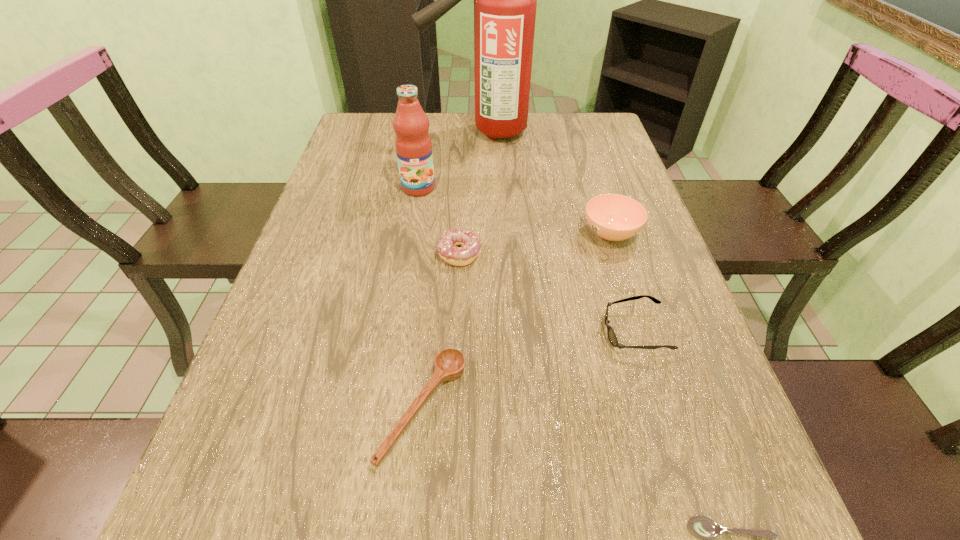
Locate an element on the screen. the tallest object is located at coordinates (505, 0).

Where is `fire extinguisher`? fire extinguisher is located at coordinates (505, 0).

Identify the location of fruit juice. (413, 145).

Where is `the sixth shortest object`? the sixth shortest object is located at coordinates (413, 145).

You are a GUI agent. You are given a task and a screenshot of the screen. Output one action in this format:
    pyautogui.click(x=<x>, y=<y>)
    Task: Click on the third tallest object
    This screenshot has height=540, width=960.
    Given the screenshot: What is the action you would take?
    pyautogui.click(x=613, y=217)

Image resolution: width=960 pixels, height=540 pixels. I want to click on doughnut, so click(x=470, y=243).

The image size is (960, 540). Identify the location of sunglasses. (612, 337).

Identify the location of the sixth tallest object. This screenshot has height=540, width=960. (449, 364).

You are a GUI agent. You are given a task and a screenshot of the screen. Output one action in this format:
    pyautogui.click(x=<x>, y=<y>)
    Task: Click on the vacant region located at the nozzle of the farthest object
    The image size is (960, 540).
    Given the screenshot: What is the action you would take?
    pyautogui.click(x=393, y=132)

Where is `vacant space situated 0.110m at the nozzle of the farthest object`? The image size is (960, 540). vacant space situated 0.110m at the nozzle of the farthest object is located at coordinates (389, 132).